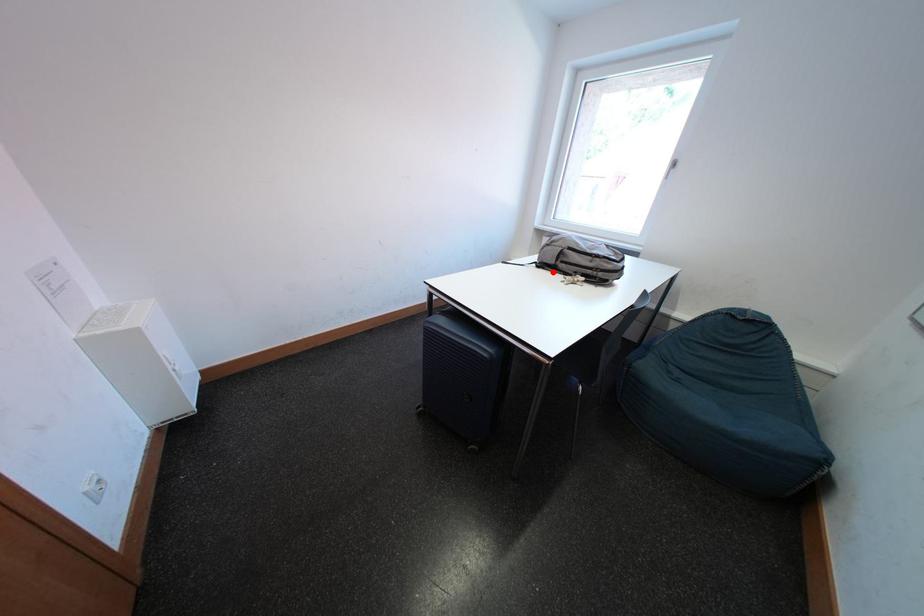
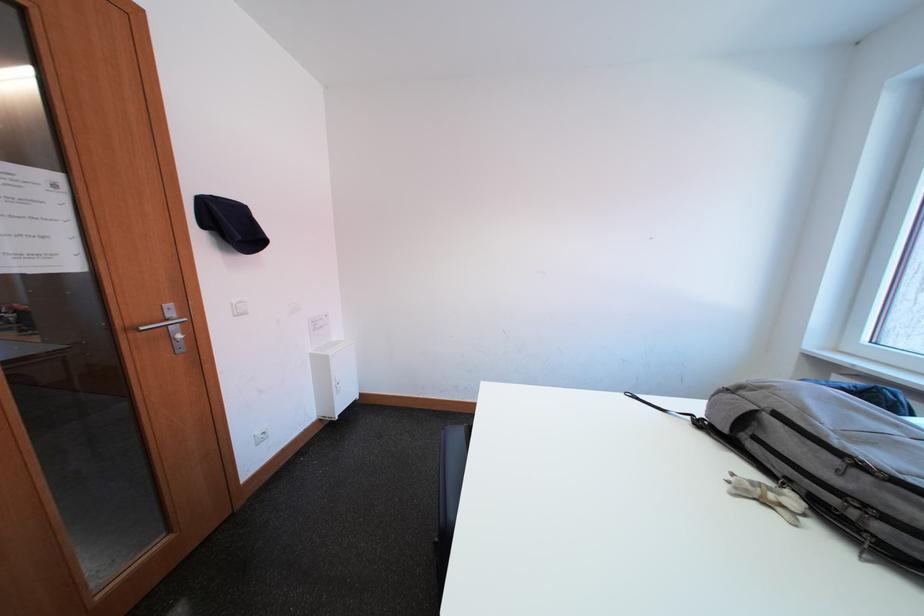
The point at the highlighted location is marked in the first image. Where is the corresponding point in the second image?

(719, 438)